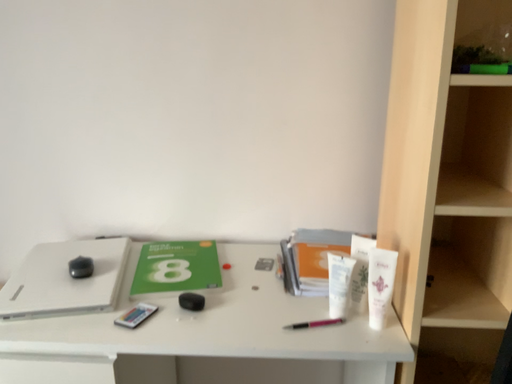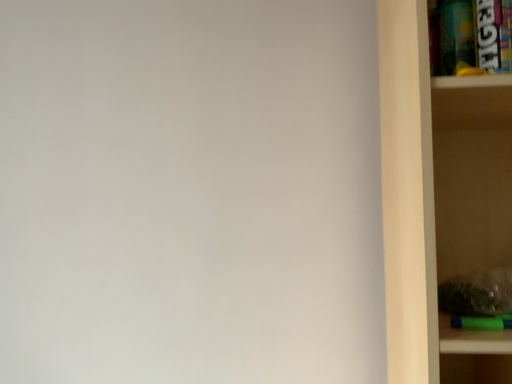
Question: How did the camera likely rotate when shooting the video?

Choices:
 (A) rotated downward
 (B) rotated upward

Answer: (B)